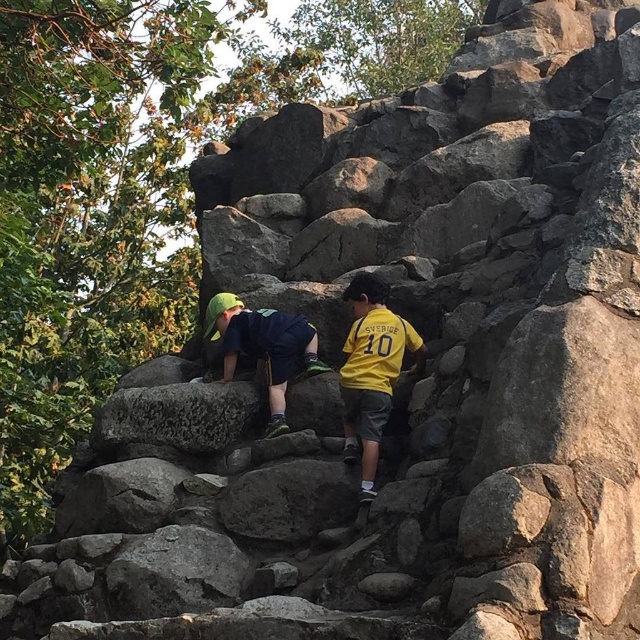
Question: Which object appears closest to the camera in this image?

Choices:
 (A) green fabric shirt at upper center
 (B) yellow jersey at center

Answer: (B)

Question: Is yellow jersey at center to the left of green fabric shirt at upper center from the viewer's perspective?

Choices:
 (A) yes
 (B) no

Answer: (B)

Question: Among these points, which one is nearest to the camera?

Choices:
 (A) (358, 298)
 (B) (269, 410)

Answer: (A)

Question: Does yellow jersey at center come behind green fabric shirt at upper center?

Choices:
 (A) no
 (B) yes

Answer: (A)

Question: Considering the relative positions of yellow jersey at center and green fabric shirt at upper center in the image provided, where is yellow jersey at center located with respect to green fabric shirt at upper center?

Choices:
 (A) above
 (B) below

Answer: (B)